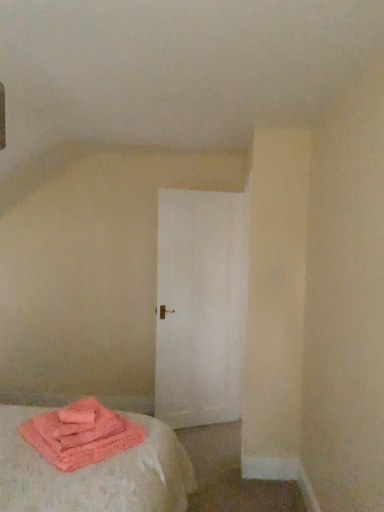
Question: Is pink fluffy towels at lower left to the left of white matte door at center from the viewer's perspective?

Choices:
 (A) yes
 (B) no

Answer: (A)

Question: Is pink fluffy towels at lower left located outside white matte door at center?

Choices:
 (A) no
 (B) yes

Answer: (B)

Question: Is pink fluffy towels at lower left thinner than white matte door at center?

Choices:
 (A) no
 (B) yes

Answer: (A)

Question: Is pink fluffy towels at lower left bigger than white matte door at center?

Choices:
 (A) yes
 (B) no

Answer: (B)

Question: Can you see pink fluffy towels at lower left touching white matte door at center?

Choices:
 (A) no
 (B) yes

Answer: (A)

Question: Is pink fluffy towels at lower left shorter than white matte door at center?

Choices:
 (A) no
 (B) yes

Answer: (B)

Question: Can you confirm if white matte door at center is positioned to the left of pink fluffy towels at lower left?

Choices:
 (A) yes
 (B) no

Answer: (B)

Question: Considering the relative sizes of white matte door at center and pink fluffy towels at lower left in the image provided, is white matte door at center bigger than pink fluffy towels at lower left?

Choices:
 (A) yes
 (B) no

Answer: (A)

Question: Does white matte door at center have a lesser height compared to pink fluffy towels at lower left?

Choices:
 (A) no
 (B) yes

Answer: (A)

Question: Is white matte door at center positioned in front of pink fluffy towels at lower left?

Choices:
 (A) yes
 (B) no

Answer: (B)

Question: Is white matte door at center positioned with its back to pink fluffy towels at lower left?

Choices:
 (A) no
 (B) yes

Answer: (A)

Question: Does white matte door at center have a lesser width compared to pink fluffy towels at lower left?

Choices:
 (A) no
 (B) yes

Answer: (B)

Question: Considering the positions of point (56, 422) and point (243, 316), is point (56, 422) closer or farther from the camera than point (243, 316)?

Choices:
 (A) closer
 (B) farther

Answer: (A)